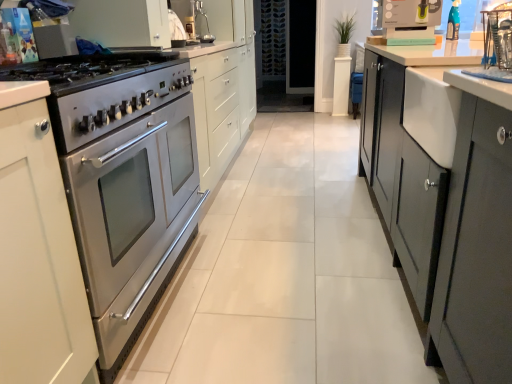
Question: Is matte silver sink at upper center closer to camera compared to transparent glass door at center?

Choices:
 (A) no
 (B) yes

Answer: (B)

Question: Is transparent glass door at center at the back of matte silver sink at upper center?

Choices:
 (A) yes
 (B) no

Answer: (B)

Question: Can you confirm if matte silver sink at upper center is bigger than transparent glass door at center?

Choices:
 (A) yes
 (B) no

Answer: (B)

Question: From a real-world perspective, is matte silver sink at upper center located beneath transparent glass door at center?

Choices:
 (A) no
 (B) yes

Answer: (A)

Question: Does matte silver sink at upper center have a lesser width compared to transparent glass door at center?

Choices:
 (A) no
 (B) yes

Answer: (A)

Question: From the image's perspective, is matte silver sink at upper center on transparent glass door at center?

Choices:
 (A) yes
 (B) no

Answer: (B)

Question: Is stainless steel oven at left taller than matte silver sink at upper center?

Choices:
 (A) yes
 (B) no

Answer: (B)

Question: Can you confirm if stainless steel oven at left is bigger than matte silver sink at upper center?

Choices:
 (A) no
 (B) yes

Answer: (B)

Question: From the image's perspective, is stainless steel oven at left on top of matte silver sink at upper center?

Choices:
 (A) no
 (B) yes

Answer: (A)

Question: Is the depth of stainless steel oven at left less than that of matte silver sink at upper center?

Choices:
 (A) yes
 (B) no

Answer: (A)

Question: Is stainless steel oven at left thinner than matte silver sink at upper center?

Choices:
 (A) yes
 (B) no

Answer: (B)

Question: From a real-world perspective, is stainless steel oven at left located higher than matte silver sink at upper center?

Choices:
 (A) no
 (B) yes

Answer: (A)

Question: Does matte yellow kettle at upper right have a greater width compared to matte silver sink at upper center?

Choices:
 (A) no
 (B) yes

Answer: (B)